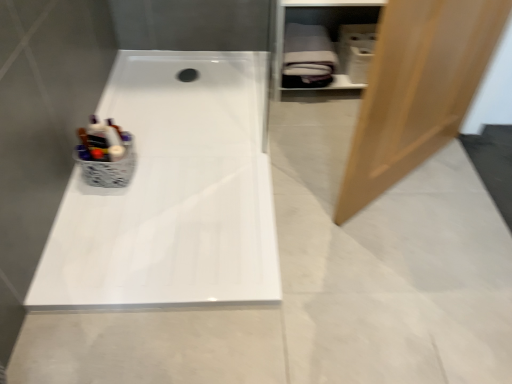
Question: From the image's perspective, is light brown wood door at right located above or below white matte shelf at upper right?

Choices:
 (A) above
 (B) below

Answer: (B)

Question: Looking at their shapes, would you say light brown wood door at right is wider or thinner than white matte shelf at upper right?

Choices:
 (A) thin
 (B) wide

Answer: (A)

Question: Estimate the real-world distances between objects in this image. Which object is closer to the light brown wood door at right?

Choices:
 (A) white matte shelf at upper right
 (B) white glossy bathtub at center

Answer: (B)

Question: Based on their relative distances, which object is farther from the white matte shelf at upper right?

Choices:
 (A) white glossy bathtub at center
 (B) light brown wood door at right

Answer: (B)